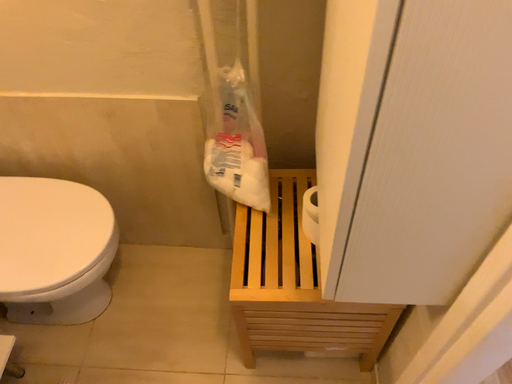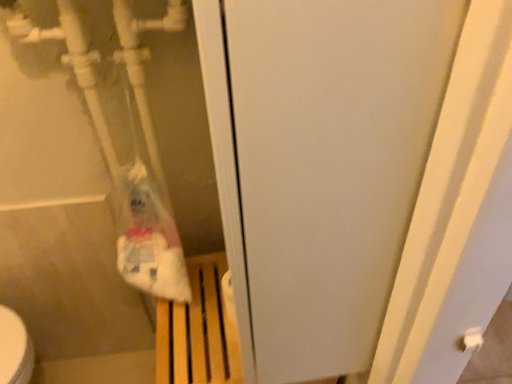
Question: How did the camera likely rotate when shooting the video?

Choices:
 (A) rotated upward
 (B) rotated downward

Answer: (A)